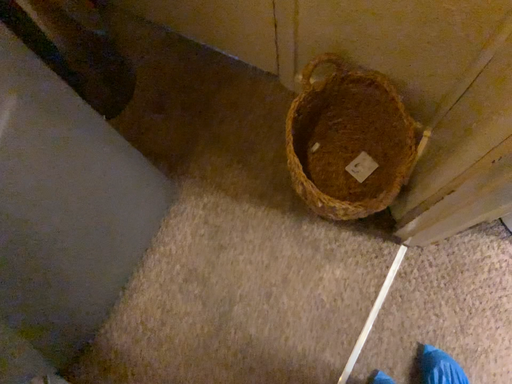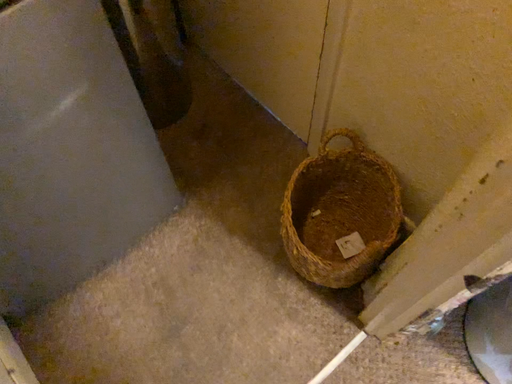
Question: How did the camera likely rotate when shooting the video?

Choices:
 (A) rotated downward
 (B) rotated upward

Answer: (B)